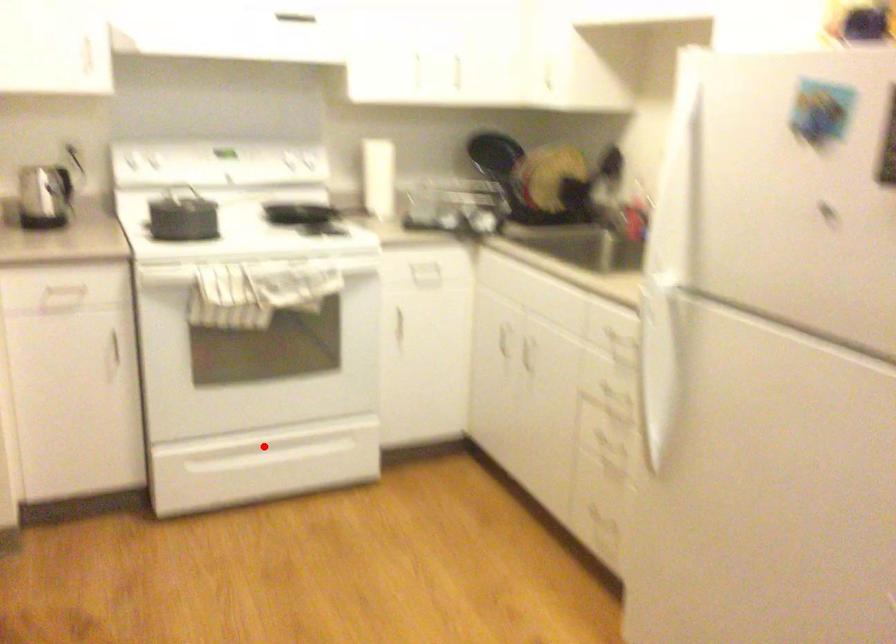
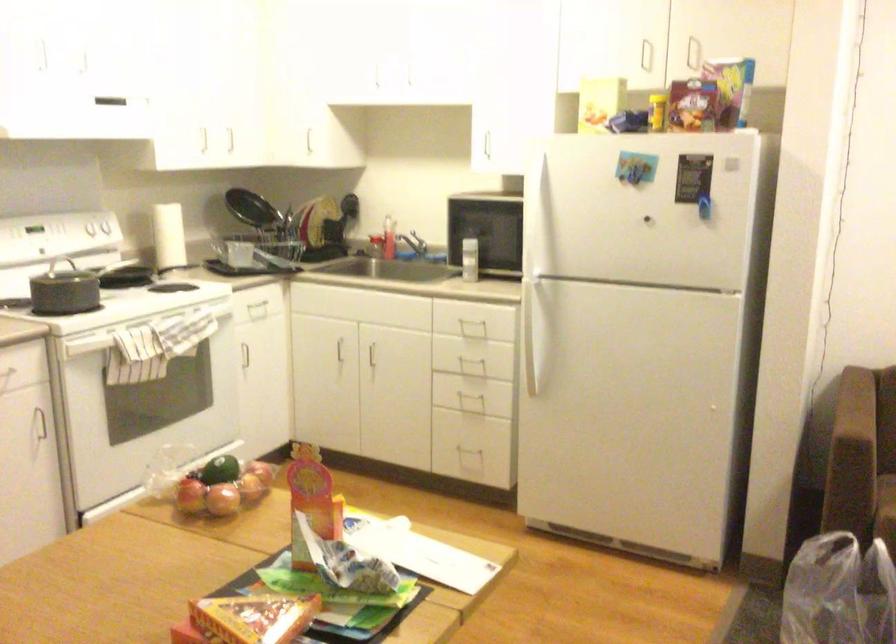
Question: I am providing you with two images of the same scene from different viewpoints. A red point is marked on the first image. Can you still see the location of the red point in image 2?

Choices:
 (A) Yes
 (B) No

Answer: (B)